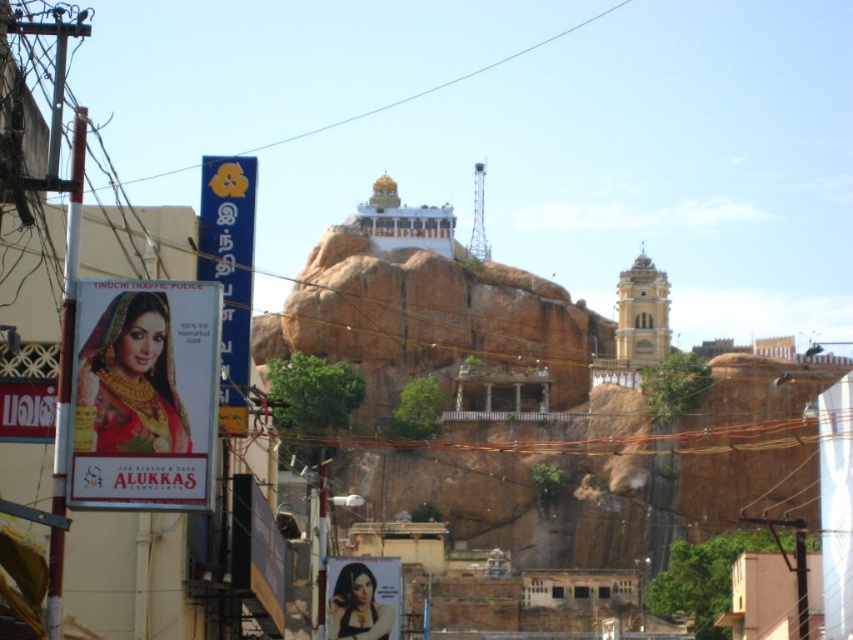
Can you confirm if matte gold billboard at left is positioned to the right of blue plastic sign at left?

Incorrect, matte gold billboard at left is not on the right side of blue plastic sign at left.

Is point (102, 403) positioned after point (241, 243)?

No, (102, 403) is closer to viewer.

This screenshot has height=640, width=853. What do you see at coordinates (144, 394) in the screenshot?
I see `matte gold billboard at left` at bounding box center [144, 394].

Find the location of a particular element. matte gold billboard at left is located at coordinates (144, 394).